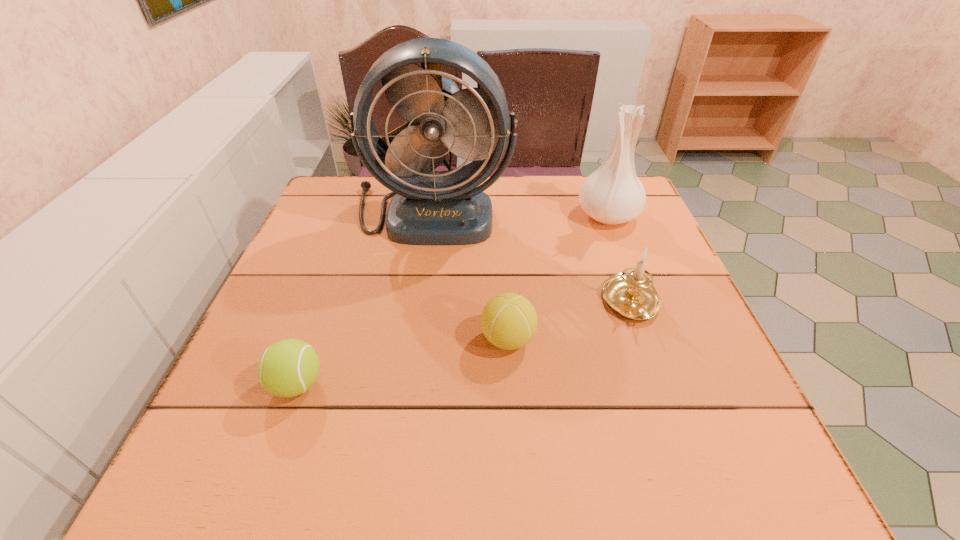
This screenshot has height=540, width=960. Find the location of `vacant region at the near edge`. vacant region at the near edge is located at coordinates (396, 446).

Locate an element on the screen. This screenshot has width=960, height=540. vacant space at the left edge of the desktop is located at coordinates (289, 435).

Find the location of `free space at the right edge`. free space at the right edge is located at coordinates (604, 225).

The height and width of the screenshot is (540, 960). I want to click on vacant region at the far left corner, so click(x=330, y=185).

Where is `free space at the far right corner`? Image resolution: width=960 pixels, height=540 pixels. free space at the far right corner is located at coordinates (649, 216).

This screenshot has width=960, height=540. I want to click on free space at the near right corner of the desktop, so click(750, 471).

I want to click on vacant point located between the vase and the tallest object, so click(520, 213).

At what (x,y) coordinates should I click in order to perform the action: click on free point between the right tennis ball and the tallest object. Please return your answer as a coordinate pair (x, y). This screenshot has width=960, height=540. Looking at the image, I should click on (470, 275).

The width and height of the screenshot is (960, 540). Find the location of `vacant area that lies between the right tennis ball and the fan`. vacant area that lies between the right tennis ball and the fan is located at coordinates (470, 275).

Where is `free space between the second tallest object and the right tennis ball`? The image size is (960, 540). free space between the second tallest object and the right tennis ball is located at coordinates (558, 278).